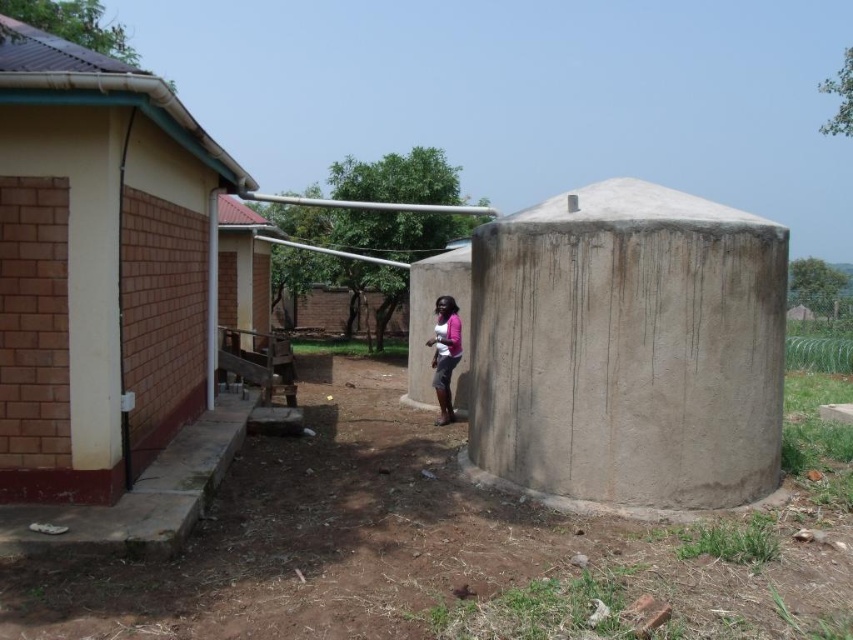
Is brown soil at center to the right of pink fabric at center from the viewer's perspective?

Correct, you'll find brown soil at center to the right of pink fabric at center.

You are a GUI agent. You are given a task and a screenshot of the screen. Output one action in this format:
    pyautogui.click(x=<x>, y=<y>)
    Task: Click on the brown soil at center
    This screenshot has height=640, width=853.
    Given the screenshot: What is the action you would take?
    pyautogui.click(x=425, y=548)

You are a GUI agent. You are given a task and a screenshot of the screen. Output one action in this format:
    pyautogui.click(x=<x>, y=<y>)
    Task: Click on the brown soil at center
    
    Given the screenshot: What is the action you would take?
    pyautogui.click(x=425, y=548)

At what (x,y) coordinates should I click in order to perform the action: click on brown soil at center. Please return your answer as a coordinate pair (x, y). Looking at the image, I should click on (425, 548).

Is brown soil at center further to the viewer compared to brown brick wall at left?

That is False.

Does brown soil at center appear under brown brick wall at left?

Yes, brown soil at center is below brown brick wall at left.

Who is more forward, (820, 580) or (12, 360)?

Point (820, 580) is in front.

I want to click on brown soil at center, so pos(425,548).

Can you confirm if brown brick wall at left is thinner than gray concrete tank at center?

Correct, brown brick wall at left's width is less than gray concrete tank at center's.

Identify the location of brown brick wall at left. (105, 300).